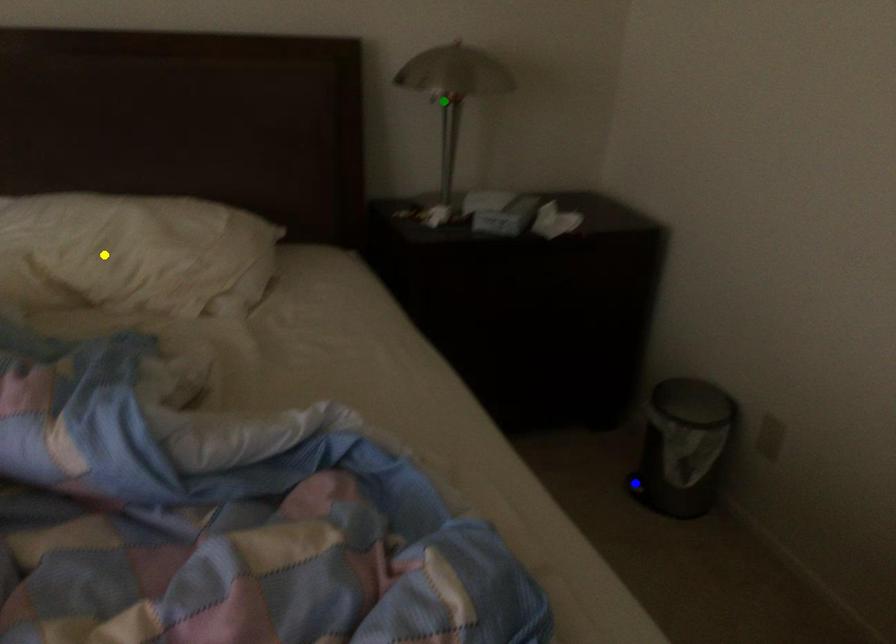
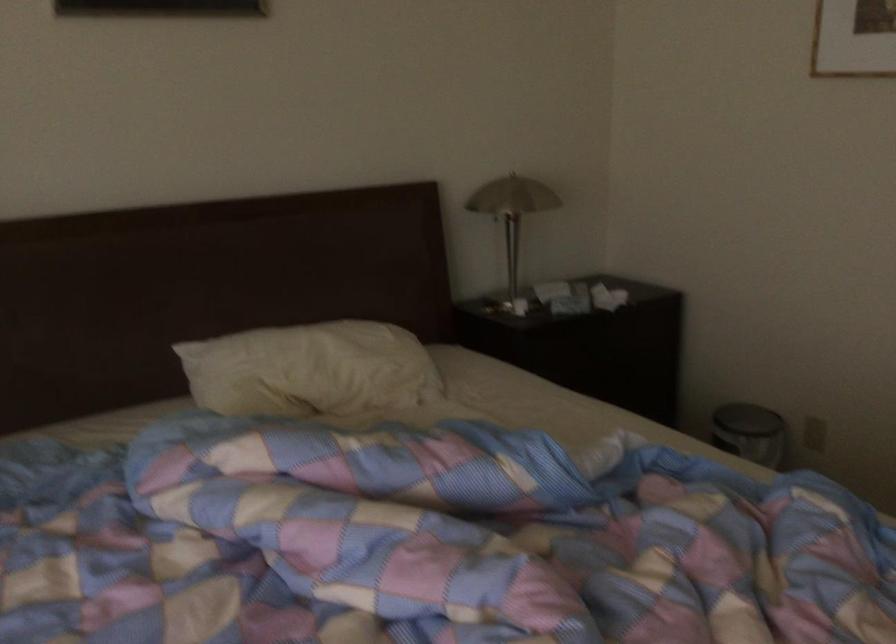
I am providing you with two images of the same scene from different viewpoints. Three points are marked in image1. Which point corresponds to a part or object that is occluded in image2?In image1, three points are marked. Which of them correspond to a part or object that is occluded in image2?Among the three points shown in image1, which one corresponds to a part or object that is no longer visible due to occlusion in image2?

Invisible in image2: blue point.